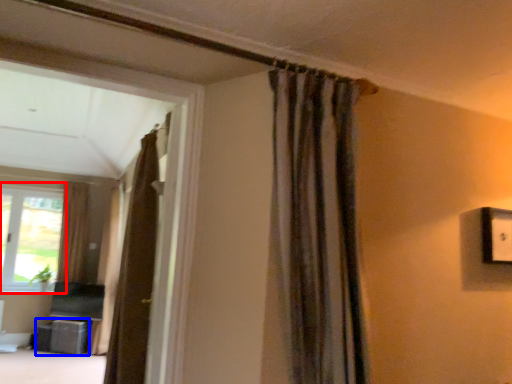
Question: Among these objects, which one is farthest to the camera, window (highlighted by a red box) or furniture (highlighted by a blue box)?

Choices:
 (A) window
 (B) furniture

Answer: (A)